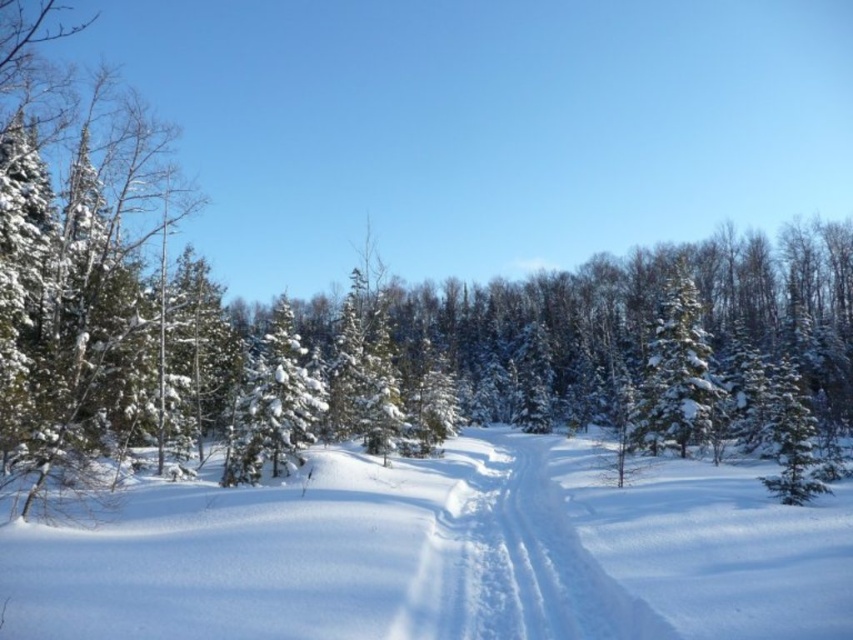
Is white powdery snow trail at center shorter than white snow-covered tree at center-right?

Yes, white powdery snow trail at center is shorter than white snow-covered tree at center-right.

Does white powdery snow trail at center have a lesser width compared to white snow-covered tree at center-right?

Indeed, white powdery snow trail at center has a lesser width compared to white snow-covered tree at center-right.

Which is in front, point (401, 614) or point (703, 408)?

Point (401, 614) is in front.

The width and height of the screenshot is (853, 640). I want to click on white powdery snow trail at center, so click(514, 560).

Can you confirm if white fluffy snow at center is smaller than white snow-covered tree at center-right?

Indeed, white fluffy snow at center has a smaller size compared to white snow-covered tree at center-right.

Who is higher up, white fluffy snow at center or white snow-covered tree at center-right?

white snow-covered tree at center-right

Which is behind, point (582, 541) or point (643, 435)?

The point (643, 435) is behind.

You are a GUI agent. You are given a task and a screenshot of the screen. Output one action in this format:
    pyautogui.click(x=<x>, y=<y>)
    Task: Click on the white fluffy snow at center
    The width and height of the screenshot is (853, 640).
    Given the screenshot: What is the action you would take?
    pyautogui.click(x=445, y=556)

Between white fluffy snow at center and white powdery snow trail at center, which one is positioned lower?

white powdery snow trail at center

Can you confirm if white fluffy snow at center is shorter than white powdery snow trail at center?

Correct, white fluffy snow at center is not as tall as white powdery snow trail at center.

Locate an element on the screen. This screenshot has height=640, width=853. white fluffy snow at center is located at coordinates (445, 556).